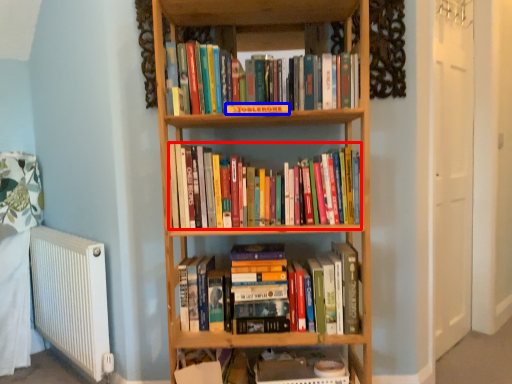
Question: Which of the following is the closest to the observer, book (highlighted by a red box) or paperback book (highlighted by a blue box)?

Choices:
 (A) book
 (B) paperback book

Answer: (B)